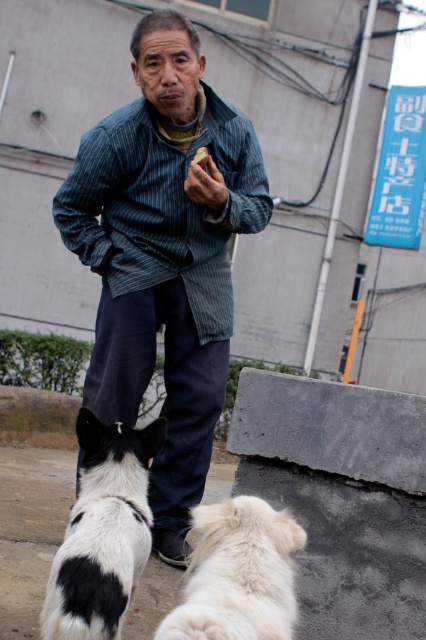
Does point (129, 497) come in front of point (178, 614)?

No, (129, 497) is behind (178, 614).

Does black-and-white fur dog at lower left have a larger size compared to white fluffy dog at lower center?

Yes.

Locate an element on the screen. This screenshot has width=426, height=640. black-and-white fur dog at lower left is located at coordinates (103, 532).

Can you confirm if striped fabric jacket at center is wider than white fluffy dog at lower center?

Yes.

Can you confirm if striped fabric jacket at center is thinner than white fluffy dog at lower center?

No.

Is point (184, 74) closer to camera compared to point (187, 538)?

That is True.

This screenshot has width=426, height=640. Identify the location of striped fabric jacket at center. (164, 253).

In the scene shown: Who is taller, striped fabric jacket at center or black-and-white fur dog at lower left?

With more height is striped fabric jacket at center.

Can you confirm if striped fabric jacket at center is shorter than black-and-white fur dog at lower left?

Incorrect, striped fabric jacket at center's height does not fall short of black-and-white fur dog at lower left's.

Find the location of a particular element. striped fabric jacket at center is located at coordinates (164, 253).